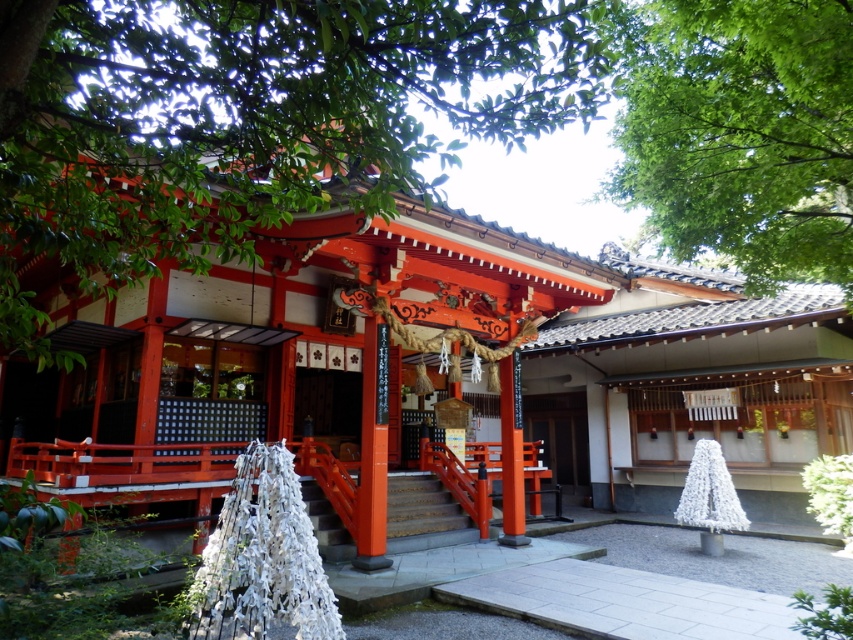
You are standing in front of the shrine and want to find the entrance. You see a green leafy tree at upper left and a smooth wooden door at center. Which object is closer to the entrance?

The smooth wooden door at center is closer to the entrance because it is positioned at the center, while the green leafy tree at upper left is on the left side of the door.

You are visiting the shrine and notice a green leafy tree at upper left and a smooth wooden door at center. Which object is shorter in height?

The green leafy tree at upper left is shorter than the smooth wooden door at center.

You are visiting the shrine and want to take a photo of the smooth wood stairs at center without any obstructions. However, there is a green leafy tree at upper left in the way. Based on their positions, can you determine if the tree will block your view of the stairs?

The green leafy tree at upper left is located above the smooth wood stairs at center, so it will block the view of the stairs if you take a photo from below looking upwards. To avoid obstruction, you should position yourself so the tree is out of frame or adjust your angle to capture the stairs without the tree overlapping.